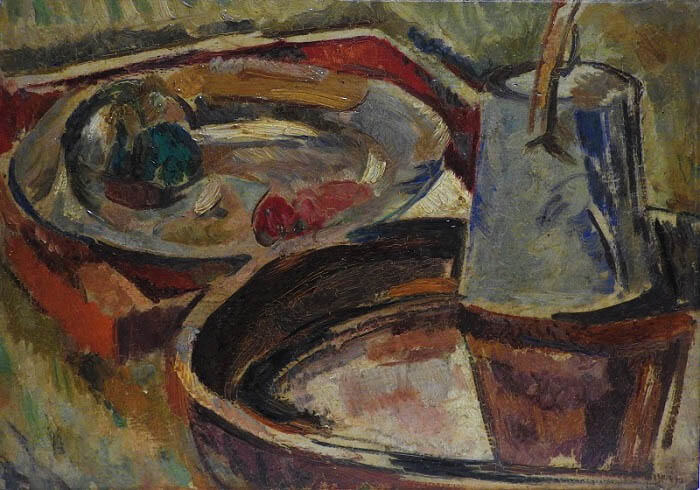
Identify the location of handle. The image size is (700, 490). (564, 27).